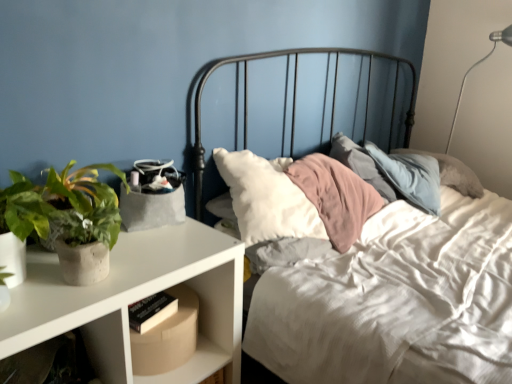
Locate an element on the screen. metallic bed at center is located at coordinates (396, 301).

In order to face green matte plant at left, should I rotate leftwards or rightwards?

To face it directly, rotate left by 21.018 degrees.

This screenshot has height=384, width=512. What do you see at coordinates (197, 339) in the screenshot?
I see `cardboard box at lower left` at bounding box center [197, 339].

The width and height of the screenshot is (512, 384). What do you see at coordinates (136, 300) in the screenshot?
I see `white matte nightstand at left` at bounding box center [136, 300].

Find the location of a particular element. Image resolution: width=512 pixels, height=384 pixels. white matte nightstand at left is located at coordinates (136, 300).

Identify the location of metallic bed at center. Image resolution: width=512 pixels, height=384 pixels. (396, 301).

Is green matte plant at left located outside metallic bed at center?

Absolutely, green matte plant at left is external to metallic bed at center.

From a real-world perspective, is green matte plant at left above or below metallic bed at center?

Clearly, from a real-world perspective, green matte plant at left is above metallic bed at center.

Where is `houseplant on the left of metallic bed at center`? This screenshot has width=512, height=384. houseplant on the left of metallic bed at center is located at coordinates (63, 205).

Does green matte plant at left appear on the left side of metallic bed at center?

Indeed, green matte plant at left is positioned on the left side of metallic bed at center.

From the image's perspective, between green matte plant at left and cardboard box at lower left, who is located below?

cardboard box at lower left is shown below in the image.

Which of these two, green matte plant at left or cardboard box at lower left, stands taller?

green matte plant at left.

Measure the distance from green matte plant at left to cardboard box at lower left.

green matte plant at left is 34.83 centimeters from cardboard box at lower left.

Is metallic bed at center closer to camera compared to cardboard box at lower left?

Yes.

In the scene shown: Is metallic bed at center beside cardboard box at lower left?

There is a gap between metallic bed at center and cardboard box at lower left.

How many degrees apart are the facing directions of metallic bed at center and cardboard box at lower left?

3.81 degrees separate the facing orientations of metallic bed at center and cardboard box at lower left.

Does metallic bed at center have a larger size compared to cardboard box at lower left?

Yes, metallic bed at center is bigger than cardboard box at lower left.

Is point (91, 170) positioned behind point (129, 243)?

Yes, point (91, 170) is farther from viewer.

In the scene shown: Is green matte plant at left turned away from white matte nightstand at left?

No, white matte nightstand at left is not at the back of green matte plant at left.

Between green matte plant at left and white matte nightstand at left, which one appears on the right side from the viewer's perspective?

white matte nightstand at left.

Considering the sizes of objects green matte plant at left and white matte nightstand at left in the image provided, who is smaller, green matte plant at left or white matte nightstand at left?

Smaller between the two is green matte plant at left.

In terms of size, does cardboard box at lower left appear bigger or smaller than metallic bed at center?

Considering their sizes, cardboard box at lower left takes up less space than metallic bed at center.

How much distance is there between cardboard box at lower left and metallic bed at center?

20.32 inches.

Which is closer to the camera, (231, 309) or (439, 262)?

Positioned in front is point (231, 309).

Considering the relative positions of cardboard box at lower left and metallic bed at center in the image provided, is cardboard box at lower left to the left of metallic bed at center from the viewer's perspective?

Indeed, cardboard box at lower left is positioned on the left side of metallic bed at center.

Can you confirm if cardboard box at lower left is positioned to the left of green matte plant at left?

No, cardboard box at lower left is not to the left of green matte plant at left.

How different are the orientations of cardboard box at lower left and green matte plant at left in degrees?

1.94 degrees separate the facing orientations of cardboard box at lower left and green matte plant at left.

From their relative heights in the image, would you say cardboard box at lower left is taller or shorter than green matte plant at left?

Considering their sizes, cardboard box at lower left has less height than green matte plant at left.

In the scene shown: Considering the relative sizes of cardboard box at lower left and green matte plant at left in the image provided, is cardboard box at lower left wider than green matte plant at left?

Yes.

From a real-world perspective, is metallic bed at center positioned over green matte plant at left based on gravity?

No, from a real-world perspective, metallic bed at center is not on top of green matte plant at left.

Does point (397, 365) come behind point (105, 231)?

Yes, it is.

What's the angular difference between metallic bed at center and green matte plant at left's facing directions?

The facing directions of metallic bed at center and green matte plant at left are 1.86 degrees apart.

Who is shorter, metallic bed at center or green matte plant at left?

green matte plant at left.

Where is `bed lying in front of the green matte plant at left`? This screenshot has width=512, height=384. bed lying in front of the green matte plant at left is located at coordinates (396, 301).

Where is `houseplant above the cardboard box at lower left (from the image's perspective)`? The height and width of the screenshot is (384, 512). houseplant above the cardboard box at lower left (from the image's perspective) is located at coordinates (63, 205).

Considering their positions, is green matte plant at left positioned closer to metallic bed at center than white matte nightstand at left?

white matte nightstand at left lies closer to metallic bed at center than the other object.

Considering their positions, is metallic bed at center positioned closer to cardboard box at lower left than white matte nightstand at left?

white matte nightstand at left is closer to cardboard box at lower left.

Which object lies further to the anchor point cardboard box at lower left, green matte plant at left or white matte nightstand at left?

Based on the image, green matte plant at left appears to be further to cardboard box at lower left.

Which object lies nearer to the anchor point white matte nightstand at left, green matte plant at left or cardboard box at lower left?

The object closer to white matte nightstand at left is cardboard box at lower left.

When comparing their distances from white matte nightstand at left, does green matte plant at left or metallic bed at center seem closer?

green matte plant at left lies closer to white matte nightstand at left than the other object.

Which object lies further to the anchor point metallic bed at center, cardboard box at lower left or white matte nightstand at left?

Based on the image, white matte nightstand at left appears to be further to metallic bed at center.

Looking at the image, which one is located closer to white matte nightstand at left, cardboard box at lower left or metallic bed at center?

The object closer to white matte nightstand at left is cardboard box at lower left.

From the image, which object appears to be farther from metallic bed at center, white matte nightstand at left or cardboard box at lower left?

white matte nightstand at left.

The height and width of the screenshot is (384, 512). In order to click on nightstand between green matte plant at left and metallic bed at center from left to right in this screenshot , I will do `click(136, 300)`.

This screenshot has width=512, height=384. What are the coordinates of `shelf situated between white matte nightstand at left and metallic bed at center from left to right` in the screenshot? It's located at (197, 339).

You are a GUI agent. You are given a task and a screenshot of the screen. Output one action in this format:
    pyautogui.click(x=<x>, y=<y>)
    Task: Click on the shelf between green matte plant at left and white matte nightstand at left in the vertical direction
    Image resolution: width=512 pixels, height=384 pixels.
    Given the screenshot: What is the action you would take?
    pyautogui.click(x=197, y=339)

This screenshot has height=384, width=512. Find the location of `shelf between green matte plant at left and metallic bed at center in the horizontal direction`. shelf between green matte plant at left and metallic bed at center in the horizontal direction is located at coordinates (197, 339).